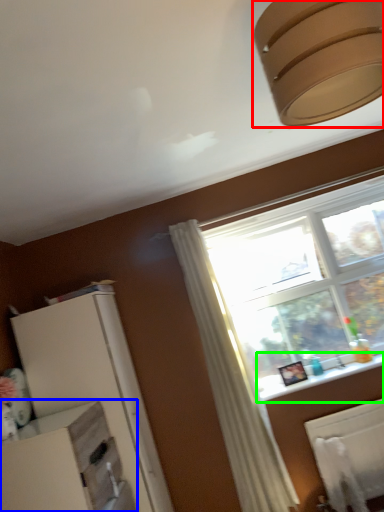
Question: Estimate the real-world distances between objects in this image. Which object is closer to lamp (highlighted by a red box), dresser (highlighted by a blue box) or window sill (highlighted by a green box)?

Choices:
 (A) dresser
 (B) window sill

Answer: (A)